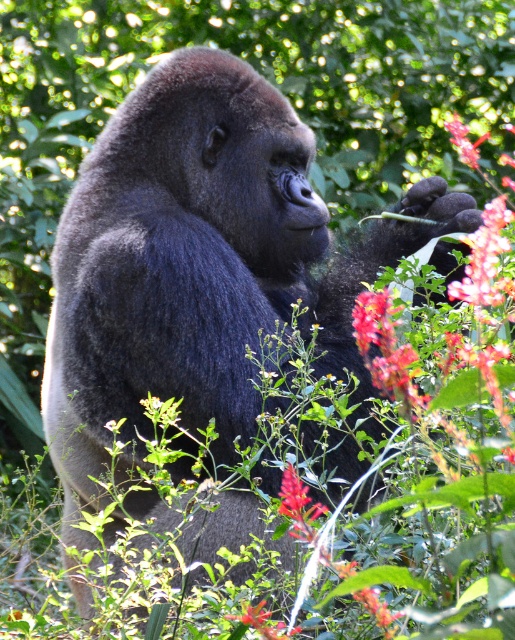
You are a photographer trying to capture the gorilla in the image. You notice two points in the scene marked as point 1 at coordinates point (277, 630) and point 2 at coordinates point (451, 128). Which point is nearer to you, the photographer?

Point (277, 630) is closer to the viewer than point (451, 128).

Consider the image. You are a botanist examining a flower in the image. You notice two sets of vibrant petals at the center. Which one is positioned to the left of the other? The options are the vibrant red petals at center and the vibrant pink petals at center.

The vibrant red petals at center are positioned to the left of the vibrant pink petals at center.

You are a botanist observing a gorilla in a green environment. You notice two flower clusters, the vivid crimson petals at upper right and the vibrant pink petals at center. Which flower cluster is shorter in height?

The vivid crimson petals at upper right has a lesser height compared to vibrant pink petals at center, so the vivid crimson petals at upper right is shorter in height.